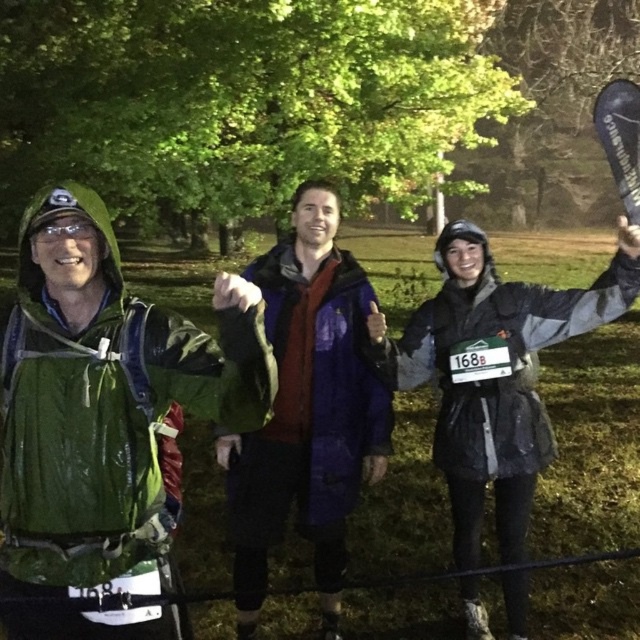
Question: In this image, where is purple matte jacket at center located relative to gray matte jacket at center?

Choices:
 (A) below
 (B) above

Answer: (A)

Question: Can you confirm if purple matte jacket at center is wider than gray matte jacket at center?

Choices:
 (A) yes
 (B) no

Answer: (B)

Question: Does purple matte jacket at center have a smaller size compared to gray matte jacket at center?

Choices:
 (A) yes
 (B) no

Answer: (A)

Question: Which point is farther to the camera?

Choices:
 (A) purple matte jacket at center
 (B) gray matte jacket at center

Answer: (A)

Question: Among these points, which one is nearest to the camera?

Choices:
 (A) (449, 356)
 (B) (326, 184)

Answer: (A)